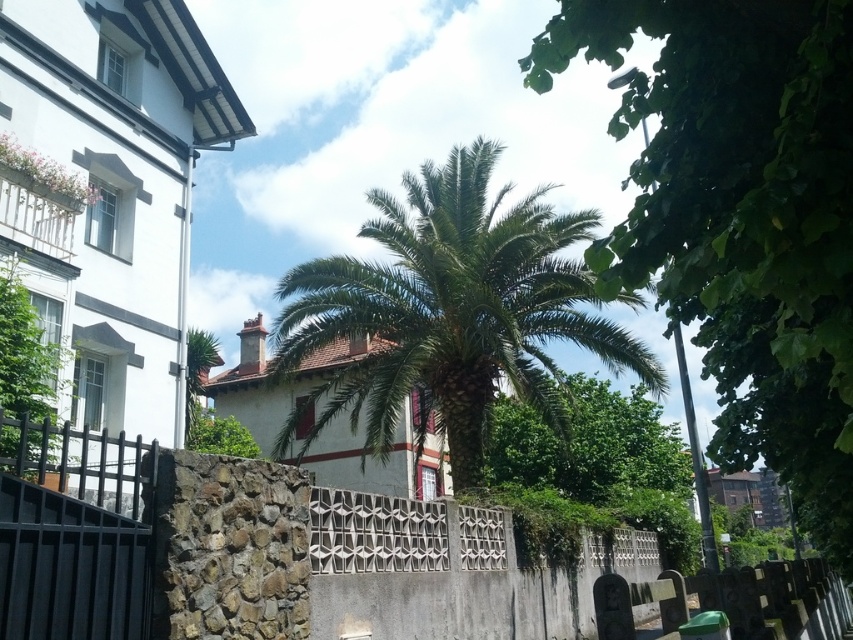
Consider the image. You are a delivery person trying to enter the property. You see the stone textured fence at center and the black metal gate at lower left. Which object should you approach first to gain access?

You should approach the black metal gate at lower left first since it is positioned to the left of the stone textured fence at center, making it the entrance point.

You are standing in the urban scene described. You see a green leafy tree at center and a green leafy palm at center. Which one is positioned to the right of the other?

The green leafy tree at center is positioned to the right of green leafy palm at center.